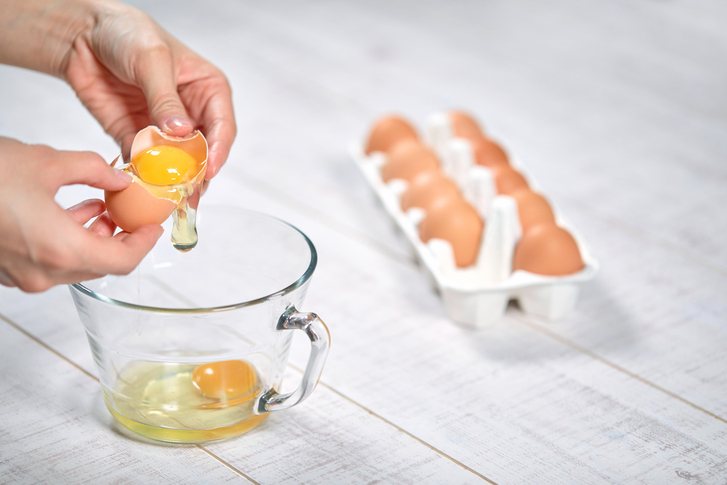
You are a GUI agent. You are given a task and a screenshot of the screen. Output one action in this format:
    pyautogui.click(x=<x>, y=<y>)
    Task: Click on the measuring cup
    The image size is (727, 485).
    Given the screenshot: What is the action you would take?
    pyautogui.click(x=249, y=317)